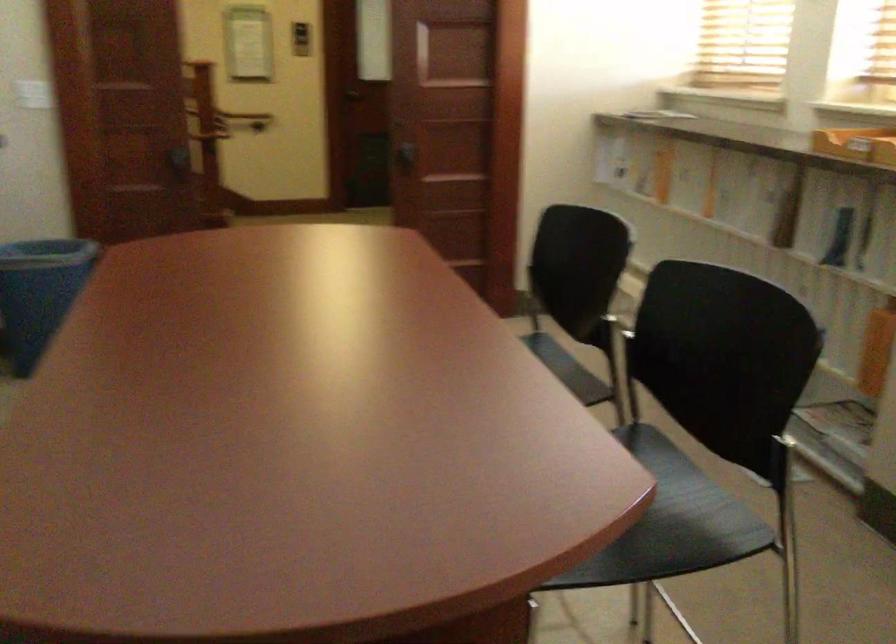
Where would you lift the wooden paper tray? Please return your answer as a coordinate pair (x, y).

(745, 140)